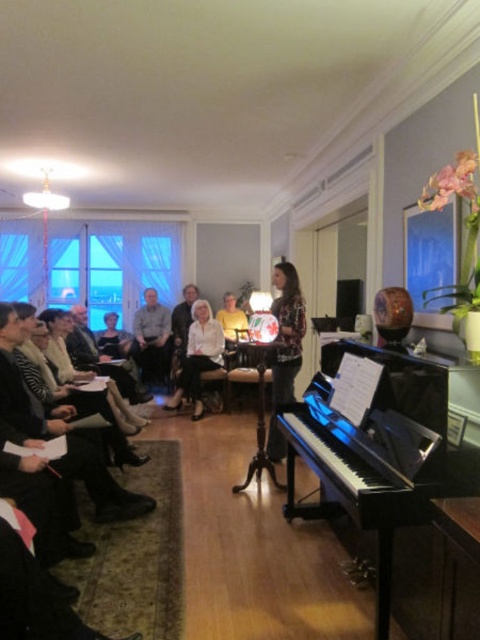
Question: Among these objects, which one is nearest to the camera?

Choices:
 (A) light brown fabric shirt at center
 (B) black polished piano at lower right

Answer: (B)

Question: Can you confirm if black polished piano at lower right is wider than light brown fabric shirt at center?

Choices:
 (A) yes
 (B) no

Answer: (A)

Question: Is black polished piano at lower right wider than light brown fabric shirt at center?

Choices:
 (A) yes
 (B) no

Answer: (A)

Question: Which object is farther from the camera taking this photo?

Choices:
 (A) matte white blouse at center
 (B) light brown fabric shirt at center
 (C) black polished piano at lower right

Answer: (B)

Question: From the image, what is the correct spatial relationship of black polished piano at lower right in relation to matte white blouse at center?

Choices:
 (A) above
 (B) below

Answer: (B)

Question: Among these points, which one is nearest to the camera?

Choices:
 (A) (159, 321)
 (B) (214, 368)

Answer: (B)